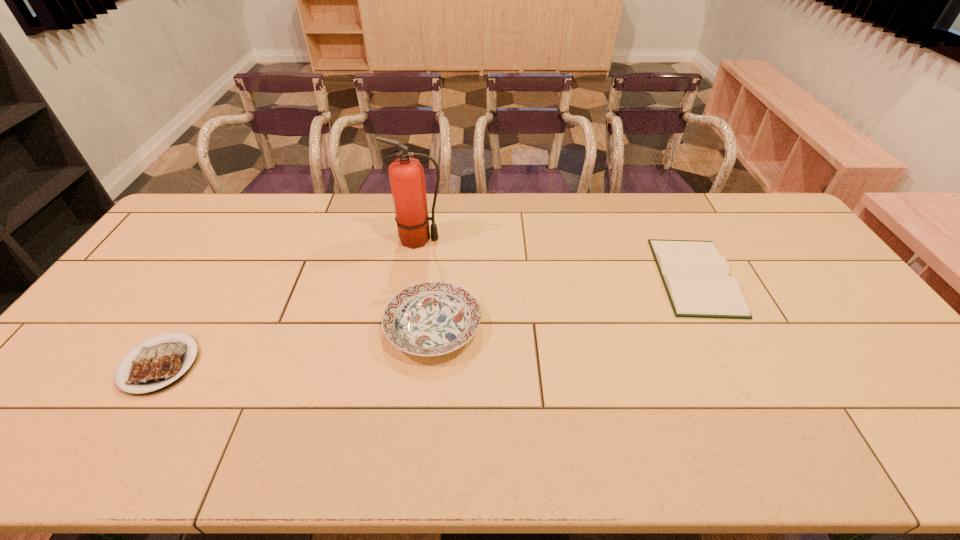
This screenshot has height=540, width=960. Identify the location of vacant space that satisfies the following two spatial constraints: 1. on the nozzle of the hardback book; 2. on the right side of the fire extinguisher. (413, 276).

Find the location of a particular element. This screenshot has width=960, height=540. vacant area in the image that satisfies the following two spatial constraints: 1. on the back side of the right plate; 2. on the nozzle of the tallest object is located at coordinates (442, 240).

I want to click on free space that satisfies the following two spatial constraints: 1. on the nozzle of the tallest object; 2. on the back side of the third shortest object, so click(404, 327).

Find the location of a particular element. The image size is (960, 540). vacant space that satisfies the following two spatial constraints: 1. on the nozzle of the right plate; 2. on the left side of the tallest object is located at coordinates (404, 327).

Identify the location of vacant area that satisfies the following two spatial constraints: 1. on the nozzle of the tallest object; 2. on the left side of the right plate. The height and width of the screenshot is (540, 960). (404, 327).